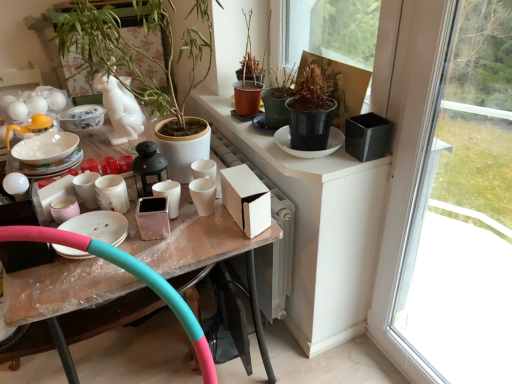
What is the approximate height of terracotta pot at upper center, which appears as the second houseplant when viewed from the left?

The height of terracotta pot at upper center, which appears as the second houseplant when viewed from the left, is 16.37 inches.

What is the approximate height of green matte plant at upper left, acting as the 2th houseplant starting from the right?

The height of green matte plant at upper left, acting as the 2th houseplant starting from the right, is 62.83 centimeters.

The image size is (512, 384). I want to click on matte pink plate at lower left, which is the 1th tableware in left-to-right order, so click(99, 226).

Where is `terracotta pot at upper center, which appears as the second houseplant when viewed from the left`? The width and height of the screenshot is (512, 384). terracotta pot at upper center, which appears as the second houseplant when viewed from the left is located at coordinates (249, 78).

Which tableware is the 3rd one when counting from the left side of the terracotta pot at upper center, the first houseplant viewed from the right? Please provide its 2D coordinates.

[(99, 226)]

How many degrees apart are the facing directions of matte pink plate at lower left, the third tableware viewed from the right, and terracotta pot at upper center, which appears as the second houseplant when viewed from the left?

There is a 5.41-degree angle between the facing directions of matte pink plate at lower left, the third tableware viewed from the right, and terracotta pot at upper center, which appears as the second houseplant when viewed from the left.

Is matte pink plate at lower left, which is the 1th tableware in left-to-right order, not near terracotta pot at upper center, the first houseplant viewed from the right?

No.

In the image, is matte pink plate at lower left, the third tableware viewed from the right, positioned in front of or behind terracotta pot at upper center, which appears as the second houseplant when viewed from the left?

matte pink plate at lower left, the third tableware viewed from the right, is in front of terracotta pot at upper center, which appears as the second houseplant when viewed from the left.

Does point (250, 97) appear closer or farther from the camera than point (36, 150)?

Point (250, 97) is farther from the camera than point (36, 150).

Which object is positioned more to the left, terracotta pot at upper center, the first houseplant viewed from the right, or matte white teapot at upper left?

matte white teapot at upper left is more to the left.

How different are the orientations of terracotta pot at upper center, which appears as the second houseplant when viewed from the left, and matte white teapot at upper left in degrees?

There is a 0.783-degree angle between the facing directions of terracotta pot at upper center, which appears as the second houseplant when viewed from the left, and matte white teapot at upper left.

Is terracotta pot at upper center, the first houseplant viewed from the right, located outside matte white teapot at upper left?

Yes, terracotta pot at upper center, the first houseplant viewed from the right, is outside of matte white teapot at upper left.

Is point (34, 127) positioned behind point (183, 323)?

Yes.

Considering the relative sizes of matte white teapot at upper left and pink rubber garden hose at lower left in the image provided, is matte white teapot at upper left wider than pink rubber garden hose at lower left?

No, matte white teapot at upper left is not wider than pink rubber garden hose at lower left.

From the image's perspective, who appears lower, matte white teapot at upper left or pink rubber garden hose at lower left?

pink rubber garden hose at lower left is shown below in the image.

Is matte pink plate at lower left, the third tableware viewed from the right, next to pink rubber hula hoop at lower left?

They are not placed beside each other.

The width and height of the screenshot is (512, 384). I want to click on tableware that is the 1st object located above the pink rubber hula hoop at lower left (from the image's perspective), so click(99, 226).

Which object is further away from the camera taking this photo, matte pink plate at lower left, the third tableware viewed from the right, or pink rubber hula hoop at lower left?

matte pink plate at lower left, the third tableware viewed from the right, is more distant.

Could you tell me if matte pink plate at lower left, which is the 1th tableware in left-to-right order, is turned towards pink rubber hula hoop at lower left?

No, matte pink plate at lower left, which is the 1th tableware in left-to-right order, is not oriented towards pink rubber hula hoop at lower left.

Is pink rubber hula hoop at lower left wider than transparent glass window at right?

Yes, pink rubber hula hoop at lower left is wider than transparent glass window at right.

Which object is further away from the camera, pink rubber hula hoop at lower left or transparent glass window at right?

pink rubber hula hoop at lower left is further away from the camera.

Which is nearer, (120, 279) or (496, 180)?

Point (120, 279) appears to be closer to the viewer than point (496, 180).

At what (x,y) coordinates should I click in order to perform the action: click on window on the right side of pink rubber hula hoop at lower left. Please return your answer as a coordinate pair (x, y). Looking at the image, I should click on (449, 196).

From the image's perspective, is white matte cup at center, which ranks as the 2th tableware in left-to-right order, over matte pink ceramic cup at center, the third tableware from the left?

Yes.

Which of these two, white matte cup at center, marked as the 2th tableware in a right-to-left arrangement, or matte pink ceramic cup at center, marked as the 1th tableware in a right-to-left arrangement, stands shorter?

Standing shorter between the two is white matte cup at center, marked as the 2th tableware in a right-to-left arrangement.

Which point is more forward, (97, 183) or (178, 201)?

The point (178, 201) is closer to the camera.

Which of these two, white matte cup at center, which ranks as the 2th tableware in left-to-right order, or matte pink ceramic cup at center, marked as the 1th tableware in a right-to-left arrangement, is smaller?

matte pink ceramic cup at center, marked as the 1th tableware in a right-to-left arrangement.

Is white matte cup at center, marked as the 2th tableware in a right-to-left arrangement, placed right next to matte white teapot at upper left?

There is a gap between white matte cup at center, marked as the 2th tableware in a right-to-left arrangement, and matte white teapot at upper left.

From the image's perspective, relative to matte white teapot at upper left, is white matte cup at center, marked as the 2th tableware in a right-to-left arrangement, above or below?

white matte cup at center, marked as the 2th tableware in a right-to-left arrangement, is below matte white teapot at upper left.

The width and height of the screenshot is (512, 384). I want to click on tea set above the white matte cup at center, marked as the 2th tableware in a right-to-left arrangement (from the image's perspective), so pos(44,149).

Measure the distance between white matte cup at center, which ranks as the 2th tableware in left-to-right order, and matte white teapot at upper left.

The distance of white matte cup at center, which ranks as the 2th tableware in left-to-right order, from matte white teapot at upper left is 14.25 inches.

From a real-world perspective, which houseplant is the 1st one above the matte pink plate at lower left, the third tableware viewed from the right? Please provide its 2D coordinates.

[(249, 78)]

Identify the location of houseplant behind the matte white teapot at upper left. This screenshot has width=512, height=384. (249, 78).

From the image, which object appears to be nearer to pink rubber hula hoop at lower left, matte white teapot at upper left or white matte cup at center, which ranks as the 2th tableware in left-to-right order?

Based on the image, white matte cup at center, which ranks as the 2th tableware in left-to-right order, appears to be nearer to pink rubber hula hoop at lower left.

Estimate the real-world distances between objects in this image. Which object is further from white matte cup at center, which ranks as the 2th tableware in left-to-right order, matte pink plate at lower left, which is the 1th tableware in left-to-right order, or pink rubber garden hose at lower left?

Among the two, pink rubber garden hose at lower left is located further to white matte cup at center, which ranks as the 2th tableware in left-to-right order.

Which object lies further to the anchor point matte white teapot at upper left, matte pink ceramic cup at center, the third tableware from the left, or green matte plant at upper left, acting as the 2th houseplant starting from the right?

matte pink ceramic cup at center, the third tableware from the left, is positioned further to the anchor matte white teapot at upper left.

Based on their spatial positions, is pink rubber garden hose at lower left or matte white teapot at upper left closer to terracotta pot at upper center, the first houseplant viewed from the right?

matte white teapot at upper left.

Estimate the real-world distances between objects in this image. Which object is closer to pink rubber hula hoop at lower left, terracotta pot at upper center, the first houseplant viewed from the right, or white matte cup at center, marked as the 2th tableware in a right-to-left arrangement?

Based on the image, white matte cup at center, marked as the 2th tableware in a right-to-left arrangement, appears to be nearer to pink rubber hula hoop at lower left.

Based on their spatial positions, is pink rubber garden hose at lower left or matte pink ceramic cup at center, marked as the 1th tableware in a right-to-left arrangement, further from green matte plant at upper left, the 1th houseplant positioned from the left?

Among the two, pink rubber garden hose at lower left is located further to green matte plant at upper left, the 1th houseplant positioned from the left.

Based on their spatial positions, is white matte cup at center, which ranks as the 2th tableware in left-to-right order, or matte white teapot at upper left closer to pink rubber garden hose at lower left?

white matte cup at center, which ranks as the 2th tableware in left-to-right order, lies closer to pink rubber garden hose at lower left than the other object.

Based on their spatial positions, is pink rubber garden hose at lower left or pink rubber hula hoop at lower left further from matte pink plate at lower left, which is the 1th tableware in left-to-right order?

pink rubber hula hoop at lower left is further to matte pink plate at lower left, which is the 1th tableware in left-to-right order.

Where is `houseplant between terracotta pot at upper center, the first houseplant viewed from the right, and matte pink plate at lower left, the third tableware viewed from the right, in the up-down direction`? houseplant between terracotta pot at upper center, the first houseplant viewed from the right, and matte pink plate at lower left, the third tableware viewed from the right, in the up-down direction is located at coordinates (135, 50).

Find the location of `tableware between green matte plant at upper left, acting as the 2th houseplant starting from the right, and transparent glass window at right`. tableware between green matte plant at upper left, acting as the 2th houseplant starting from the right, and transparent glass window at right is located at coordinates (169, 195).

Find the location of a particular element. tea set between terracotta pot at upper center, the first houseplant viewed from the right, and pink rubber garden hose at lower left from top to bottom is located at coordinates (44, 149).

Locate an element on the screen. The width and height of the screenshot is (512, 384). table between matte white teapot at upper left and pink rubber garden hose at lower left in the up-down direction is located at coordinates (62, 295).